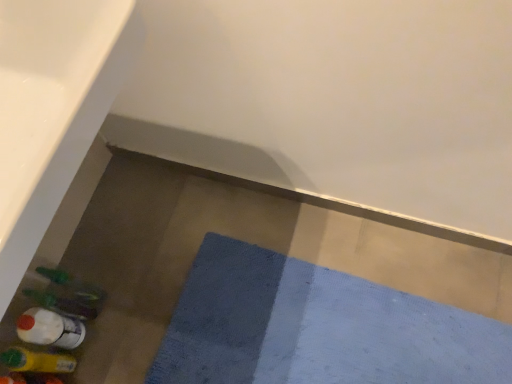
You are a GUI agent. You are given a task and a screenshot of the screen. Output one action in this format:
    pyautogui.click(x=<x>, y=<y>)
    Task: Click on the free space behind translucent plastic bottle at lower left, which is the second bottle from top to bottom
    The image size is (512, 384).
    Given the screenshot: What is the action you would take?
    pyautogui.click(x=92, y=266)